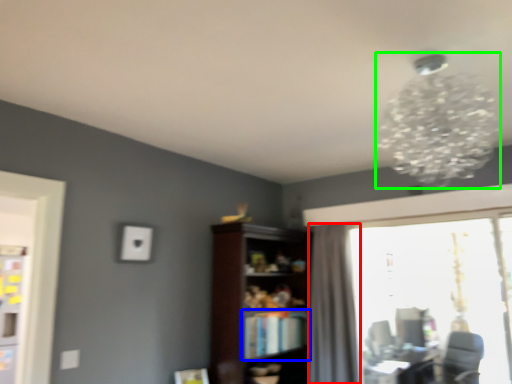
Question: Which object is the farthest from curtain (highlighted by a red box)? Choose among these: book (highlighted by a blue box) or lamp (highlighted by a green box).

Choices:
 (A) book
 (B) lamp

Answer: (B)